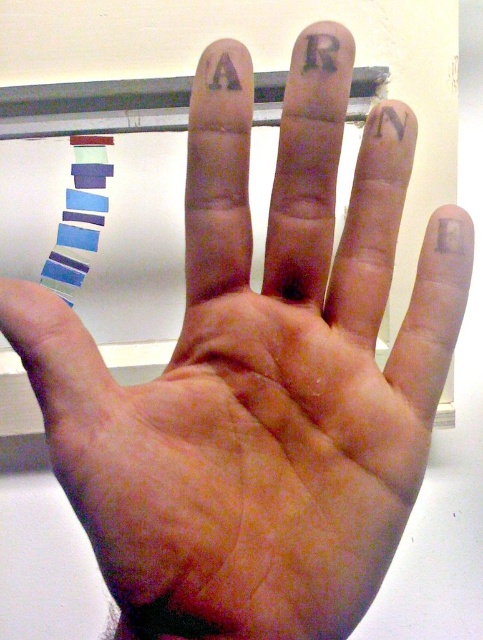
You are an artist trying to paint a letter on your hand. You have two options for the design size. The black tattoo at upper center and the matte purple letter a at upper center. Which one is taller so it can be seen better from a distance?

The matte purple letter a at upper center is taller than the black tattoo at upper center, so it can be seen better from a distance.

You are a tattoo artist assessing the space on a client hand. The client wants to add a new tattoo between the black tattoo at upper center and the matte purple letter a at upper center. Can you determine if there is enough space between them?

The black tattoo at upper center might be wider than matte purple letter a at upper center, so there may not be sufficient space between them for a new tattoo. It is recommended to measure the exact dimensions before proceeding.

You are an artist trying to replicate the letters on the hand. You have a purple marker and a black marker. If you want to make sure the black matte letter at upper right is bigger than the matte purple letter a at upper center, which marker should you use for each letter?

The black matte letter at upper right is already larger in width than the matte purple letter a at upper center. To maintain this size difference, use the black marker for the black matte letter at upper right and the purple marker for the matte purple letter a at upper center.